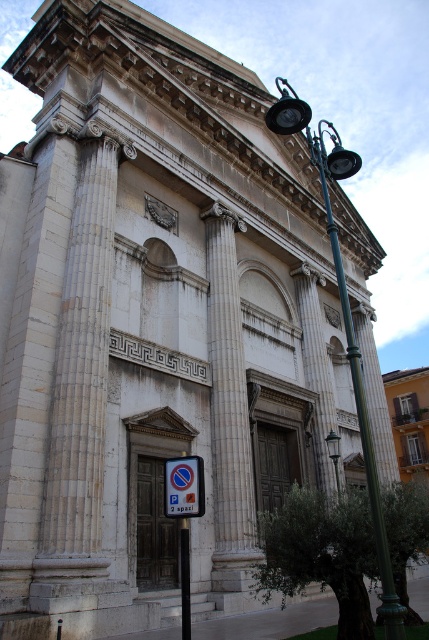
Does green metal streetlight at upper right appear on the left side of blue plastic parking sign at lower center?

In fact, green metal streetlight at upper right is to the right of blue plastic parking sign at lower center.

Where is `green metal streetlight at upper right`? The width and height of the screenshot is (429, 640). green metal streetlight at upper right is located at coordinates (344, 317).

Does green metal streetlight at upper right appear on the left side of metallic pole at center?

In fact, green metal streetlight at upper right is to the right of metallic pole at center.

Can you confirm if green metal streetlight at upper right is smaller than metallic pole at center?

Actually, green metal streetlight at upper right might be larger than metallic pole at center.

At what (x,y) coordinates should I click in order to perform the action: click on green metal streetlight at upper right. Please return your answer as a coordinate pair (x, y). The width and height of the screenshot is (429, 640). Looking at the image, I should click on (344, 317).

Can you confirm if white plastic parking sign at lower center is smaller than metallic pole at center?

No, white plastic parking sign at lower center is not smaller than metallic pole at center.

Image resolution: width=429 pixels, height=640 pixels. Identify the location of white plastic parking sign at lower center. (184, 515).